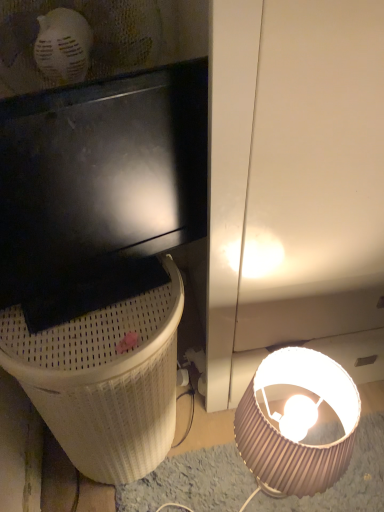
The width and height of the screenshot is (384, 512). What do you see at coordinates (291, 440) in the screenshot? I see `pink pleated lampshade at lower right` at bounding box center [291, 440].

Where is `pink pleated lampshade at lower right`? This screenshot has width=384, height=512. pink pleated lampshade at lower right is located at coordinates (291, 440).

Measure the distance between pink pleated lampshade at lower right and camera.

They are 29.98 inches apart.

The width and height of the screenshot is (384, 512). Describe the element at coordinates (104, 380) in the screenshot. I see `white textured trash bin/can at lower left` at that location.

What are the coordinates of `white textured trash bin/can at lower left` in the screenshot? It's located at (104, 380).

Measure the distance between point (x=136, y=399) and camera.

They are 33.98 inches apart.

Where is `pink pleated lampshade at lower right`? pink pleated lampshade at lower right is located at coordinates (291, 440).

Which is more to the right, pink pleated lampshade at lower right or white textured trash bin/can at lower left?

Positioned to the right is pink pleated lampshade at lower right.

Is the position of pink pleated lampshade at lower right less distant than that of white textured trash bin/can at lower left?

No, pink pleated lampshade at lower right is further to the viewer.

Which is behind, point (339, 468) or point (57, 428)?

The point (57, 428) is farther.

Looking at this image, from the image's perspective, is pink pleated lampshade at lower right located above or below white textured trash bin/can at lower left?

pink pleated lampshade at lower right is situated lower than white textured trash bin/can at lower left in the image.

From a real-world perspective, is pink pleated lampshade at lower right on top of white textured trash bin/can at lower left?

Actually, pink pleated lampshade at lower right is physically below white textured trash bin/can at lower left in the real world.

From the picture: Looking at their sizes, would you say pink pleated lampshade at lower right is wider or thinner than white textured trash bin/can at lower left?

Clearly, pink pleated lampshade at lower right has less width compared to white textured trash bin/can at lower left.

In terms of height, does pink pleated lampshade at lower right look taller or shorter compared to white textured trash bin/can at lower left?

pink pleated lampshade at lower right is shorter than white textured trash bin/can at lower left.

Considering the sizes of objects pink pleated lampshade at lower right and white textured trash bin/can at lower left in the image provided, who is smaller, pink pleated lampshade at lower right or white textured trash bin/can at lower left?

pink pleated lampshade at lower right.

Is pink pleated lampshade at lower right inside the boundaries of white textured trash bin/can at lower left, or outside?

pink pleated lampshade at lower right cannot be found inside white textured trash bin/can at lower left.

Is pink pleated lampshade at lower right positioned far away from white textured trash bin/can at lower left?

No, there isn't a large distance between pink pleated lampshade at lower right and white textured trash bin/can at lower left.

From the picture: Is pink pleated lampshade at lower right oriented towards white textured trash bin/can at lower left?

No.

Could you measure the distance between pink pleated lampshade at lower right and white textured trash bin/can at lower left?

They are 30.06 centimeters apart.

You are a GUI agent. You are given a task and a screenshot of the screen. Output one action in this format:
    pyautogui.click(x=<x>, y=<y>)
    Task: Click on the lamp below the white textured trash bin/can at lower left (from the image's perspective)
    The image size is (384, 512).
    Given the screenshot: What is the action you would take?
    pyautogui.click(x=291, y=440)

Considering the positions of objects white textured trash bin/can at lower left and pink pleated lampshade at lower right in the image provided, who is more to the right, white textured trash bin/can at lower left or pink pleated lampshade at lower right?

pink pleated lampshade at lower right.

Which object is closer to the camera taking this photo, white textured trash bin/can at lower left or pink pleated lampshade at lower right?

white textured trash bin/can at lower left is in front.

Which point is more distant from viewer, (114, 326) or (343, 450)?

The point (114, 326) is behind.

From the image's perspective, is white textured trash bin/can at lower left located above or below pink pleated lampshade at lower right?

Based on their image positions, white textured trash bin/can at lower left is located above pink pleated lampshade at lower right.

From a real-world perspective, between white textured trash bin/can at lower left and pink pleated lampshade at lower right, who is vertically lower?

pink pleated lampshade at lower right is physically lower.

Looking at their sizes, would you say white textured trash bin/can at lower left is wider or thinner than pink pleated lampshade at lower right?

Considering their sizes, white textured trash bin/can at lower left looks broader than pink pleated lampshade at lower right.

Considering the relative sizes of white textured trash bin/can at lower left and pink pleated lampshade at lower right in the image provided, is white textured trash bin/can at lower left shorter than pink pleated lampshade at lower right?

In fact, white textured trash bin/can at lower left may be taller than pink pleated lampshade at lower right.

Is white textured trash bin/can at lower left smaller than pink pleated lampshade at lower right?

No, white textured trash bin/can at lower left is not smaller than pink pleated lampshade at lower right.

Is white textured trash bin/can at lower left positioned beyond the bounds of pink pleated lampshade at lower right?

Yes.

Is white textured trash bin/can at lower left in contact with pink pleated lampshade at lower right?

No, white textured trash bin/can at lower left is not with pink pleated lampshade at lower right.

Is white textured trash bin/can at lower left facing away from pink pleated lampshade at lower right?

white textured trash bin/can at lower left does not have its back to pink pleated lampshade at lower right.

What are the coordinates of `trash bin/can above the pink pleated lampshade at lower right (from a real-world perspective)` in the screenshot? It's located at (104, 380).

You are a GUI agent. You are given a task and a screenshot of the screen. Output one action in this format:
    pyautogui.click(x=<x>, y=<y>)
    Task: Click on the trash bin/can lying in front of the pink pleated lampshade at lower right
    
    Given the screenshot: What is the action you would take?
    pyautogui.click(x=104, y=380)

Locate an element on the screen. The image size is (384, 512). lamp located behind the white textured trash bin/can at lower left is located at coordinates (291, 440).